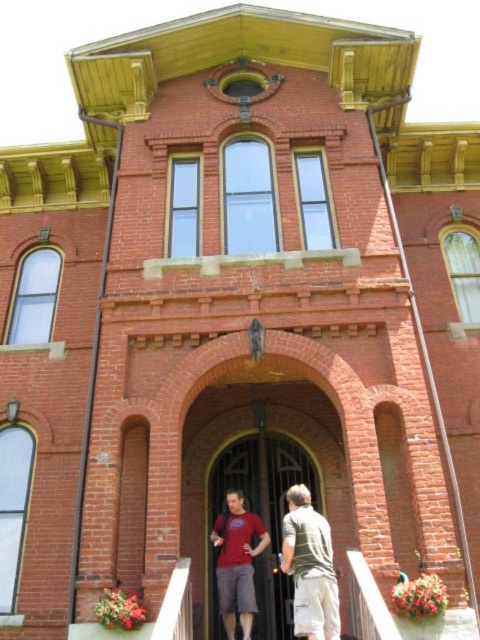
You are standing in front of the two story brick building with a Victorian architectural style. You see a black metal door at center and a green textured shirt at center. Which object is closer to you?

The black metal door at center is closer to you because it is further to the viewer than the green textured shirt at center.

Based on the photo, you are standing in front of the two story brick building with Victorian architecture. You see a point at coordinates (310, 566). What object is located at that point?

The point at coordinates (310, 566) corresponds to the green textured shirt at center.